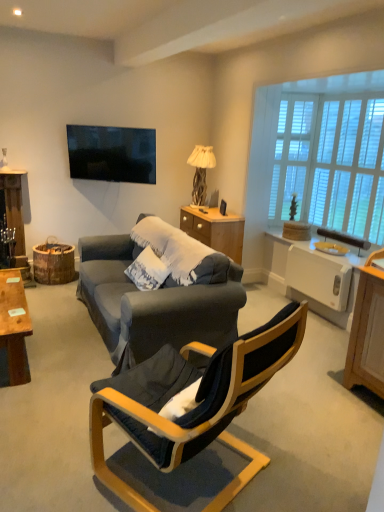
Question: Is wooden desk at left completely or partially outside of yellow plastic loudspeaker at upper right?

Choices:
 (A) yes
 (B) no

Answer: (A)

Question: Is wooden desk at left placed right next to yellow plastic loudspeaker at upper right?

Choices:
 (A) yes
 (B) no

Answer: (B)

Question: Is yellow plastic loudspeaker at upper right located within wooden desk at left?

Choices:
 (A) no
 (B) yes

Answer: (A)

Question: Can you confirm if wooden desk at left is smaller than yellow plastic loudspeaker at upper right?

Choices:
 (A) yes
 (B) no

Answer: (B)

Question: From a real-world perspective, is wooden desk at left under yellow plastic loudspeaker at upper right?

Choices:
 (A) yes
 (B) no

Answer: (A)

Question: Is there a large distance between wooden desk at left and yellow plastic loudspeaker at upper right?

Choices:
 (A) yes
 (B) no

Answer: (A)

Question: Is yellow plastic loudspeaker at upper right positioned far away from wooden textured lamp at center?

Choices:
 (A) no
 (B) yes

Answer: (B)

Question: Would you say yellow plastic loudspeaker at upper right contains wooden textured lamp at center?

Choices:
 (A) yes
 (B) no

Answer: (B)

Question: From a real-world perspective, does yellow plastic loudspeaker at upper right sit lower than wooden textured lamp at center?

Choices:
 (A) yes
 (B) no

Answer: (A)

Question: Is yellow plastic loudspeaker at upper right smaller than wooden textured lamp at center?

Choices:
 (A) yes
 (B) no

Answer: (A)

Question: From the image's perspective, is yellow plastic loudspeaker at upper right located beneath wooden textured lamp at center?

Choices:
 (A) no
 (B) yes

Answer: (B)

Question: From the image's perspective, is yellow plastic loudspeaker at upper right on top of wooden textured lamp at center?

Choices:
 (A) no
 (B) yes

Answer: (A)

Question: Is velvet dark blue chair at center far away from white wooden window at upper right, the 2th window in the right-to-left sequence?

Choices:
 (A) yes
 (B) no

Answer: (A)